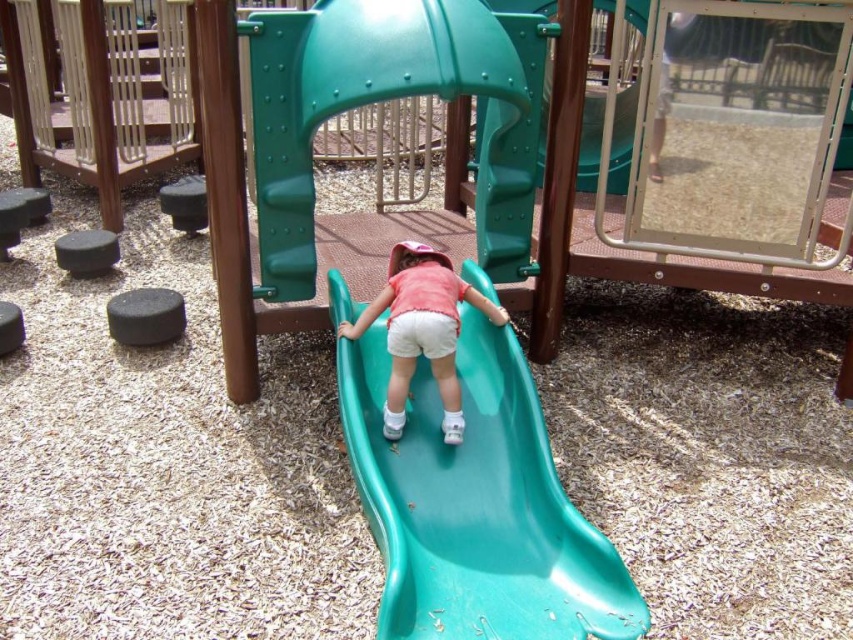
You are a parent at the playground and want to choose a slide for your child to climb. You have two options in the image, the green plastic slide at center and the matte plastic slide at center. Which one is larger?

The green plastic slide at center is bigger than the matte plastic slide at center, so the green plastic slide at center is the larger one.

You are a parent supervising children at the playground. You notice two slides at the center of the image. Which one is closer to you, the green plastic slide at center or the matte plastic slide at center?

The green plastic slide at center is closer to you because it is in front of the matte plastic slide at center.